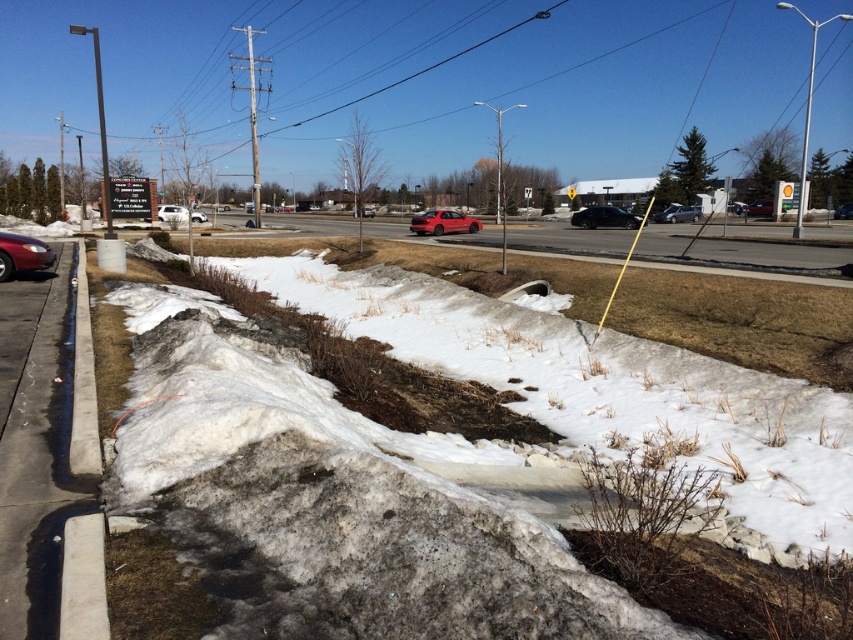
Question: Does concrete sidewalk at left have a smaller size compared to white matte van at center?

Choices:
 (A) yes
 (B) no

Answer: (A)

Question: Which of these objects is positioned closest to the concrete at left?

Choices:
 (A) metallic silver minivan at center
 (B) matte red car at center

Answer: (A)

Question: Which point is farther to the camera?

Choices:
 (A) white matte van at center
 (B) matte red car at center
 (C) shiny red sedan at center
 (D) concrete at left

Answer: (B)

Question: Which object appears farthest from the camera in this image?

Choices:
 (A) black matte sedan at center
 (B) concrete at left
 (C) shiny red sedan at center
 (D) white powdery snow at lower center

Answer: (A)

Question: Is white matte van at center thinner than metallic silver minivan at center?

Choices:
 (A) yes
 (B) no

Answer: (B)

Question: Does concrete at left have a larger size compared to shiny black sedan at left?

Choices:
 (A) yes
 (B) no

Answer: (A)